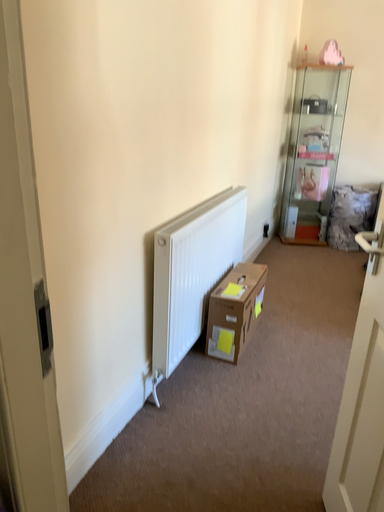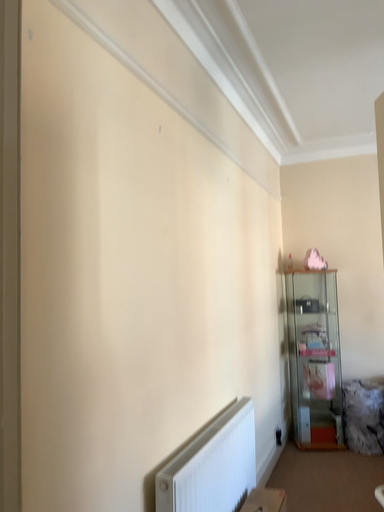
Question: Which way did the camera rotate in the video?

Choices:
 (A) rotated downward
 (B) rotated upward

Answer: (B)